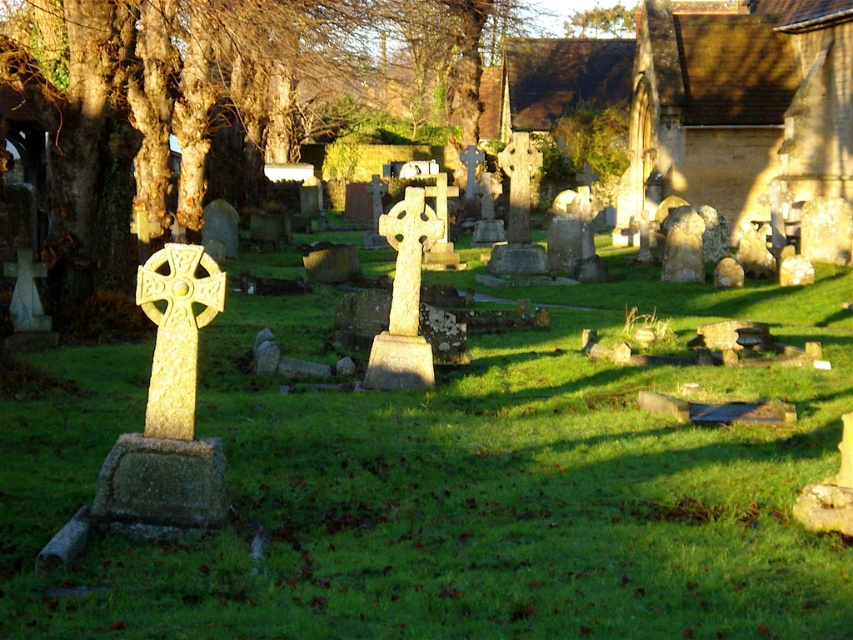
Is point (170, 28) closer to viewer compared to point (155, 401)?

No, it is not.

Does smooth bark tree at center have a smaller size compared to golden stone cross at center?

Actually, smooth bark tree at center might be larger than golden stone cross at center.

Which is in front, point (167, 152) or point (186, 317)?

Point (186, 317)

Where is `smooth bark tree at center`? Image resolution: width=853 pixels, height=640 pixels. smooth bark tree at center is located at coordinates (167, 99).

Between point (291, 614) and point (171, 372), which one is positioned behind?

Point (171, 372)

Is point (633, 374) closer to viewer compared to point (178, 355)?

No, (633, 374) is further to viewer.

Measure the distance between point (328, 298) and camera.

A distance of 25.13 meters exists between point (328, 298) and camera.

The height and width of the screenshot is (640, 853). I want to click on green grassy at center, so click(x=453, y=484).

From the picture: Is green grassy at center thinner than stone textured church at upper right?

No.

Is point (833, 573) positioned before point (747, 108)?

Yes.

This screenshot has width=853, height=640. In order to click on green grassy at center in this screenshot , I will do `click(453, 484)`.